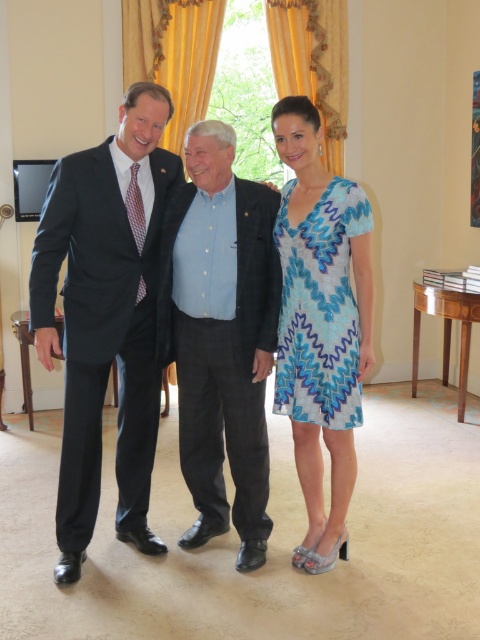
You are a photographer arranging a group photo. You have two subjects wearing the matte black suit at left and the blue cotton shirt at center. Considering their positions, which subject should you move closer to the camera to ensure both appear equally wide in the photo?

Since the matte black suit at left might be wider than the blue cotton shirt at center, you should move the blue cotton shirt at center closer to the camera so that both appear equally wide in the photo.

You are a photographer arranging a group photo. You have two subjects wearing the blue cotton shirt at center and the blue printed dress at center. Since both are positioned at the center, which clothing item takes up more horizontal space in the photo?

The blue cotton shirt at center takes up more horizontal space because its width is larger than the blue printed dress at center.